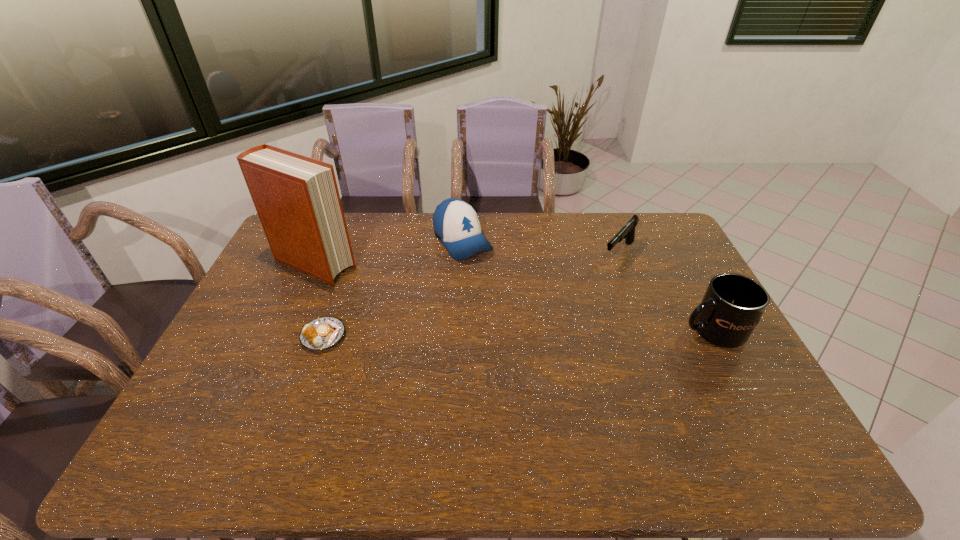
You are a GUI agent. You are given a task and a screenshot of the screen. Output one action in this format:
    pyautogui.click(x=<x>, y=<y>)
    Task: Click on the vacant space situated on the front-facing side of the baseball cap
    Image resolution: width=960 pixels, height=540 pixels.
    Given the screenshot: What is the action you would take?
    pyautogui.click(x=526, y=319)

You are a GUI agent. You are given a task and a screenshot of the screen. Output one action in this format:
    pyautogui.click(x=<x>, y=<y>)
    Task: Click on the free spot located 0.090m on the front-facing side of the baseball cap
    The width and height of the screenshot is (960, 540).
    Given the screenshot: What is the action you would take?
    pyautogui.click(x=490, y=276)

Where is `free space located on the front-facing side of the baseball cap`? The image size is (960, 540). free space located on the front-facing side of the baseball cap is located at coordinates (499, 287).

The image size is (960, 540). I want to click on free space located on the open cover of the tallest object, so click(x=401, y=297).

This screenshot has width=960, height=540. What are the coordinates of `vacant space located on the open cover of the tallest object` in the screenshot? It's located at (414, 302).

Find the location of a particular element. The height and width of the screenshot is (540, 960). vacant space located on the open cover of the tallest object is located at coordinates (424, 307).

At what (x,y) coordinates should I click in order to perform the action: click on free space located 0.190m at the aiming end of the gun. Please return your answer as a coordinate pair (x, y). The height and width of the screenshot is (540, 960). Looking at the image, I should click on (583, 299).

You are a GUI agent. You are given a task and a screenshot of the screen. Output one action in this format:
    pyautogui.click(x=<x>, y=<y>)
    Task: Click on the free location located at the aiming end of the gun
    
    Given the screenshot: What is the action you would take?
    pyautogui.click(x=588, y=293)

The width and height of the screenshot is (960, 540). I want to click on vacant space located at the aiming end of the gun, so click(x=572, y=311).

The image size is (960, 540). What are the coordinates of `baseball cap situated at the far edge` in the screenshot? It's located at (456, 224).